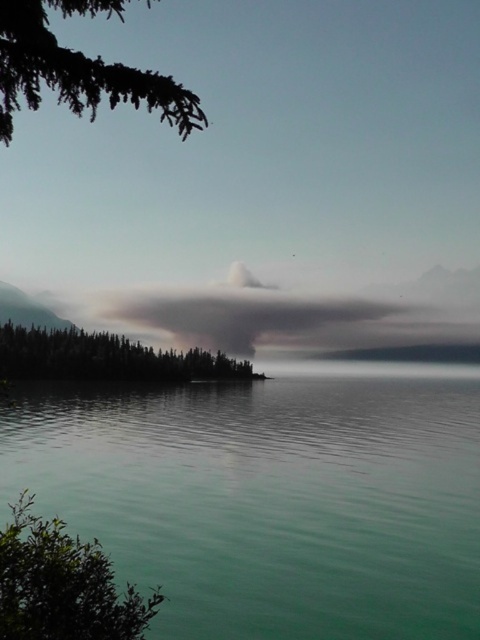
Question: Which is farther from the green leafy bush at lower left?

Choices:
 (A) teal smooth water at center
 (B) gray/dense cloud at center
 (C) green matte trees at left
 (D) green leafy branch at upper left

Answer: (B)

Question: Where is gray/dense cloud at center located in relation to green leafy bush at lower left in the image?

Choices:
 (A) below
 (B) above

Answer: (B)

Question: Which of the following is the farthest from the observer?

Choices:
 (A) (179, 120)
 (B) (187, 365)
 (C) (251, 500)

Answer: (B)

Question: Based on their relative distances, which object is farther from the green leafy branch at upper left?

Choices:
 (A) green leafy bush at lower left
 (B) green matte trees at left
 (C) teal smooth water at center

Answer: (C)

Question: Can you confirm if gray/dense cloud at center is positioned to the left of green matte trees at left?

Choices:
 (A) no
 (B) yes

Answer: (A)

Question: Is gray/dense cloud at center positioned at the back of green leafy branch at upper left?

Choices:
 (A) yes
 (B) no

Answer: (A)